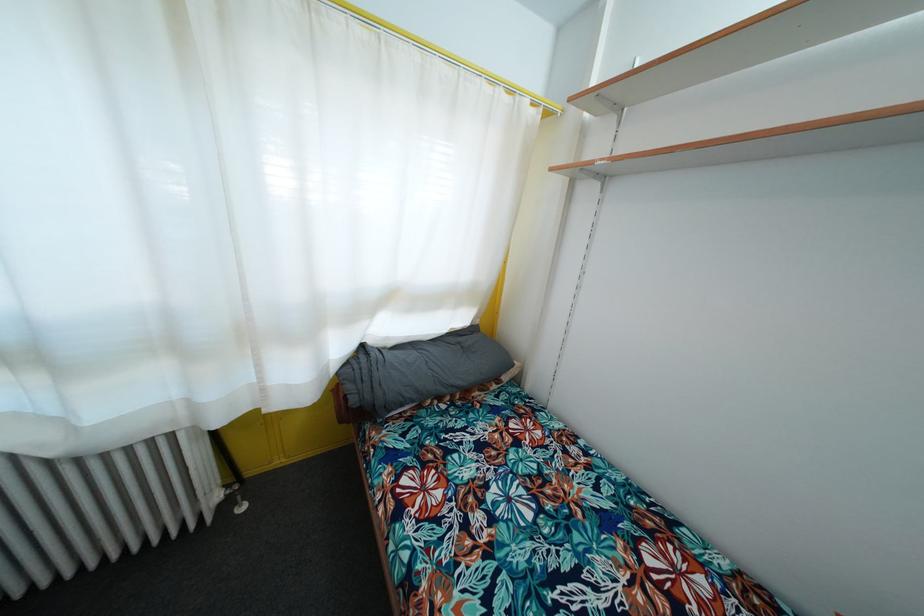
The height and width of the screenshot is (616, 924). I want to click on gray pillow, so click(419, 371).